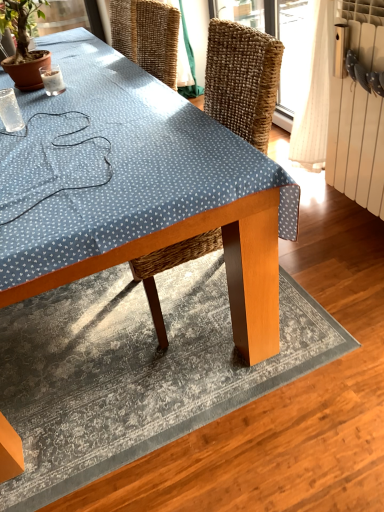
Question: Is the position of green leafy plant at upper left more distant than that of wooden table at center?

Choices:
 (A) yes
 (B) no

Answer: (A)

Question: Is green leafy plant at upper left to the right of wooden table at center from the viewer's perspective?

Choices:
 (A) yes
 (B) no

Answer: (B)

Question: Does green leafy plant at upper left turn towards wooden table at center?

Choices:
 (A) no
 (B) yes

Answer: (A)

Question: Does green leafy plant at upper left lie in front of wooden table at center?

Choices:
 (A) no
 (B) yes

Answer: (A)

Question: Does green leafy plant at upper left touch wooden table at center?

Choices:
 (A) yes
 (B) no

Answer: (B)

Question: Considering the relative sizes of green leafy plant at upper left and wooden table at center in the image provided, is green leafy plant at upper left thinner than wooden table at center?

Choices:
 (A) no
 (B) yes

Answer: (B)

Question: Is white radiator at right placed right next to wooden table at center?

Choices:
 (A) yes
 (B) no

Answer: (B)

Question: From a real-world perspective, is white radiator at right physically below wooden table at center?

Choices:
 (A) yes
 (B) no

Answer: (A)

Question: Is white radiator at right positioned behind wooden table at center?

Choices:
 (A) yes
 (B) no

Answer: (A)

Question: Can you confirm if white radiator at right is smaller than wooden table at center?

Choices:
 (A) yes
 (B) no

Answer: (A)

Question: Does white radiator at right have a lesser height compared to wooden table at center?

Choices:
 (A) no
 (B) yes

Answer: (B)

Question: Does white radiator at right turn towards wooden table at center?

Choices:
 (A) yes
 (B) no

Answer: (A)

Question: From a real-world perspective, is wooden table at center positioned over green leafy plant at upper left based on gravity?

Choices:
 (A) no
 (B) yes

Answer: (A)